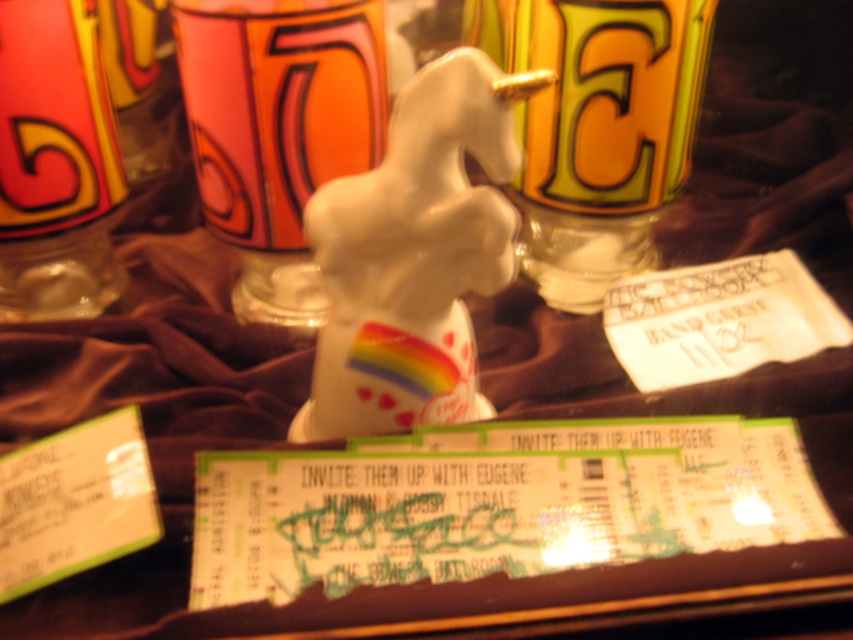
Locate an element on the screen. white glossy unicorn at center is located at coordinates (413, 257).

Who is lower down, white glossy unicorn at center or matte ceramic mug at center?

white glossy unicorn at center

I want to click on white glossy unicorn at center, so click(413, 257).

Between white glossy unicorn at center and matte ceramic mug at upper center, which one appears on the right side from the viewer's perspective?

matte ceramic mug at upper center is more to the right.

At what (x,y) coordinates should I click in order to perform the action: click on white glossy unicorn at center. Please return your answer as a coordinate pair (x, y). Image resolution: width=853 pixels, height=640 pixels. Looking at the image, I should click on (413, 257).

Which is in front, point (460, 278) or point (47, 310)?

Point (460, 278) is more forward.

Can you confirm if white glossy unicorn at center is taller than translucent glass bottle at left?

No.

Between point (451, 369) and point (83, 264), which one is positioned behind?

Positioned behind is point (83, 264).

Image resolution: width=853 pixels, height=640 pixels. Find the location of `white glossy unicorn at center`. white glossy unicorn at center is located at coordinates (413, 257).